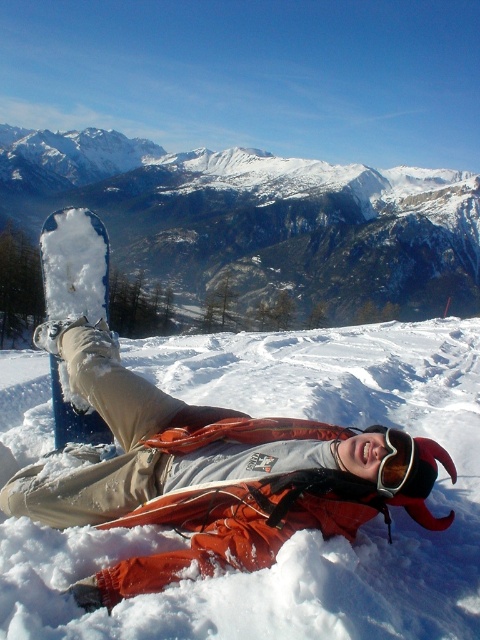
Question: Is white fluffy snow at lower center closer to the viewer compared to white snowboard at upper left?

Choices:
 (A) no
 (B) yes

Answer: (B)

Question: Considering the real-world distances, which object is farthest from the white fluffy snow at lower center?

Choices:
 (A) white snowboard at upper left
 (B) transparent plastic goggles at upper center

Answer: (A)

Question: Which object is the farthest from the transparent plastic goggles at upper center?

Choices:
 (A) white snowboard at upper left
 (B) white fluffy snow at lower center

Answer: (A)

Question: Does white snowboard at upper left have a greater width compared to transparent plastic goggles at upper center?

Choices:
 (A) no
 (B) yes

Answer: (B)

Question: Does white snowboard at upper left lie behind transparent plastic goggles at upper center?

Choices:
 (A) no
 (B) yes

Answer: (B)

Question: Which object is the closest to the transparent plastic goggles at upper center?

Choices:
 (A) white fluffy snow at lower center
 (B) white snowboard at upper left

Answer: (A)